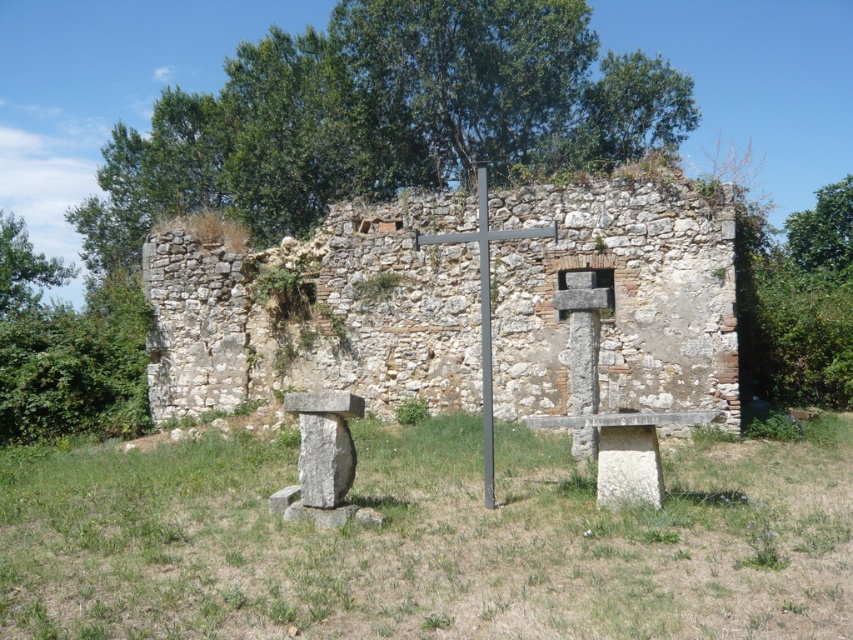
Does point (490, 435) lie in front of point (0, 230)?

That is True.

Does point (428, 240) come behind point (10, 292)?

That is False.

Identify the location of metallic cross at center. The height and width of the screenshot is (640, 853). (485, 307).

Does green grass at center appear on the left side of weathered stone ruins at center?

Answer: Incorrect, green grass at center is not on the left side of weathered stone ruins at center.

Is point (194, 440) closer to viewer compared to point (529, 276)?

No, (194, 440) is behind (529, 276).

Is point (38, 541) farther from camera compared to point (299, 256)?

No, (38, 541) is closer to viewer.

Where is `green grass at center`? This screenshot has height=640, width=853. green grass at center is located at coordinates [x=428, y=540].

Which of these two, green grass at center or green leafy tree at upper center, stands taller?

green leafy tree at upper center is taller.

In the scene shown: Which is more to the right, green grass at center or green leafy tree at upper center?

green leafy tree at upper center is more to the right.

What are the coordinates of `green grass at center` in the screenshot? It's located at (428, 540).